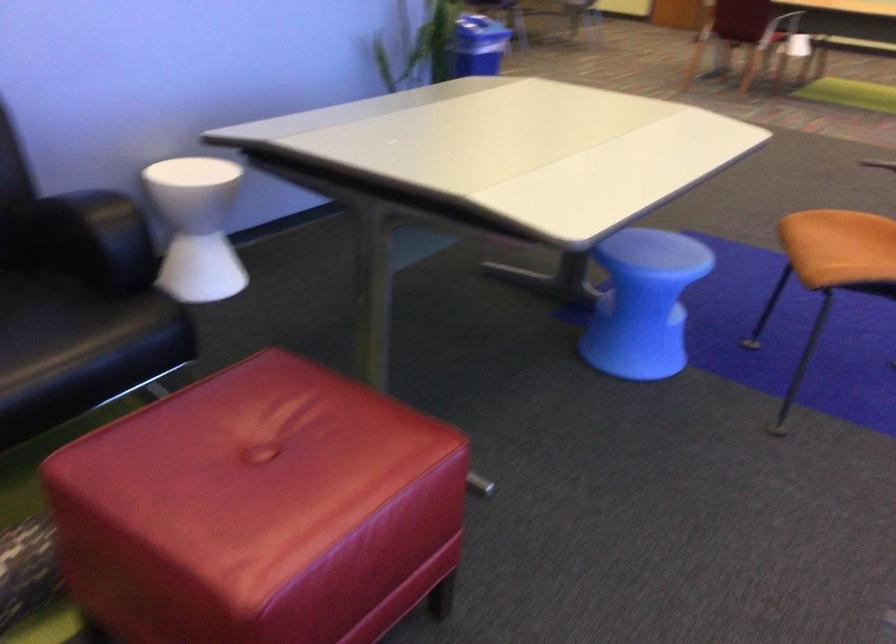
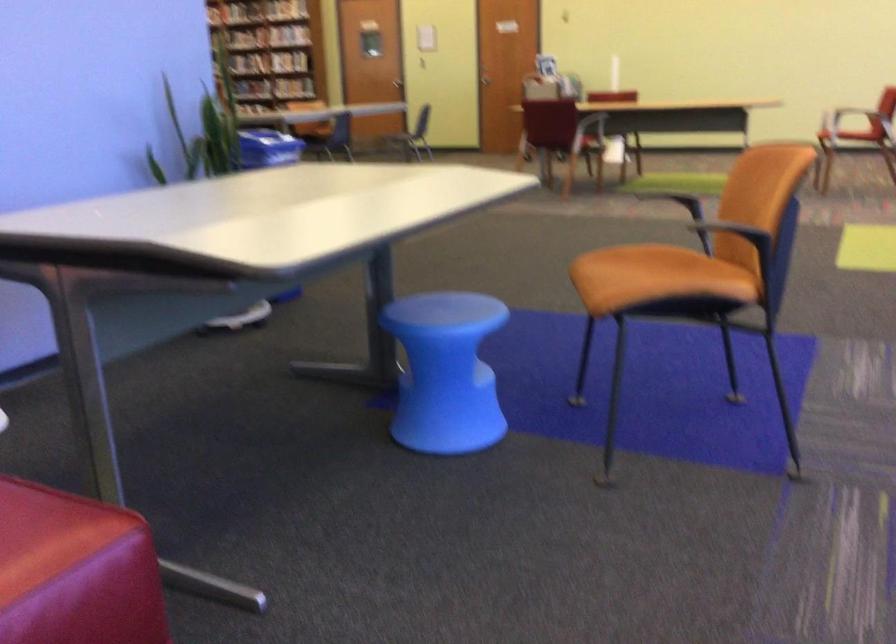
In a continuous first-person perspective shot, in which direction is the camera moving?

The cameraman walked toward right, forward.